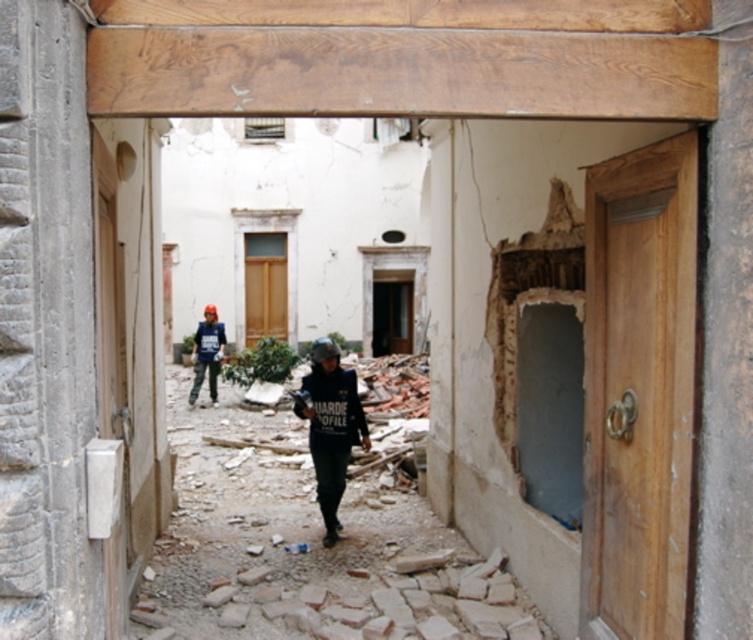
You are a member of the rescue team in the corridor. You need to move towards the camouflage pants at center to check for hazards. Is the dark blue uniform at center blocking your path?

The dark blue uniform at center is closer to the viewer than the camouflage pants at center, so the dark blue uniform at center is blocking your path.

You are a member of the rescue team in the scene. You need to retrieve an item from the ground between the dark blue uniform at center and the camouflage pants at center. Which direction should you move to reach the item?

The dark blue uniform at center is positioned under camouflage pants at center, so you should move downward to reach the item between them.